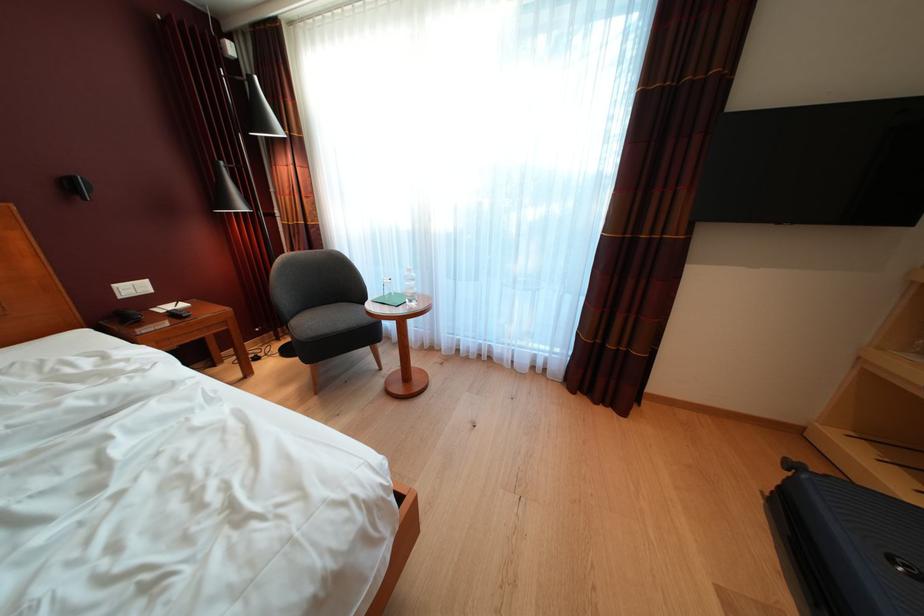
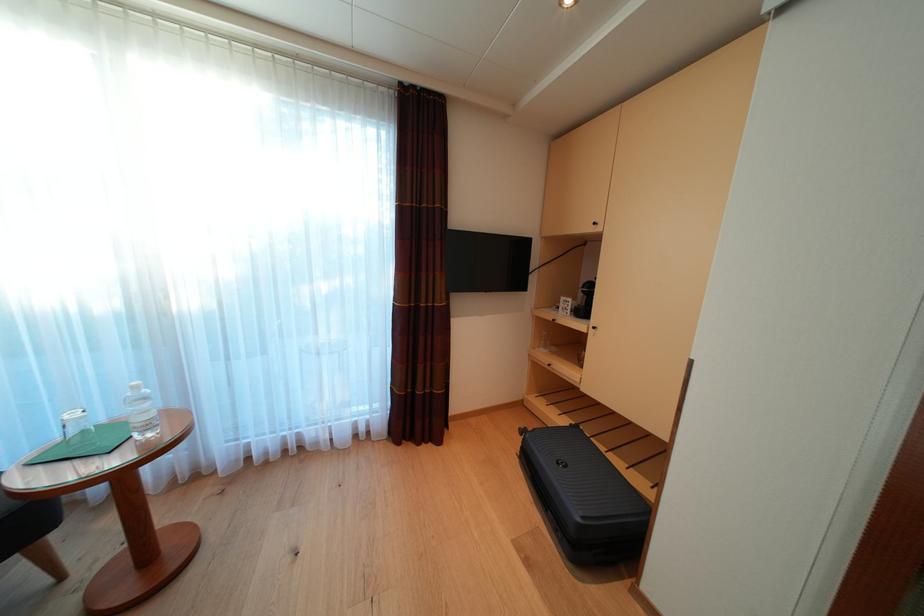
Question: The first image is from the beginning of the video and the second image is from the end. How did the camera likely rotate when shooting the video?

Choices:
 (A) Left
 (B) Right
 (C) Up
 (D) Down

Answer: (B)